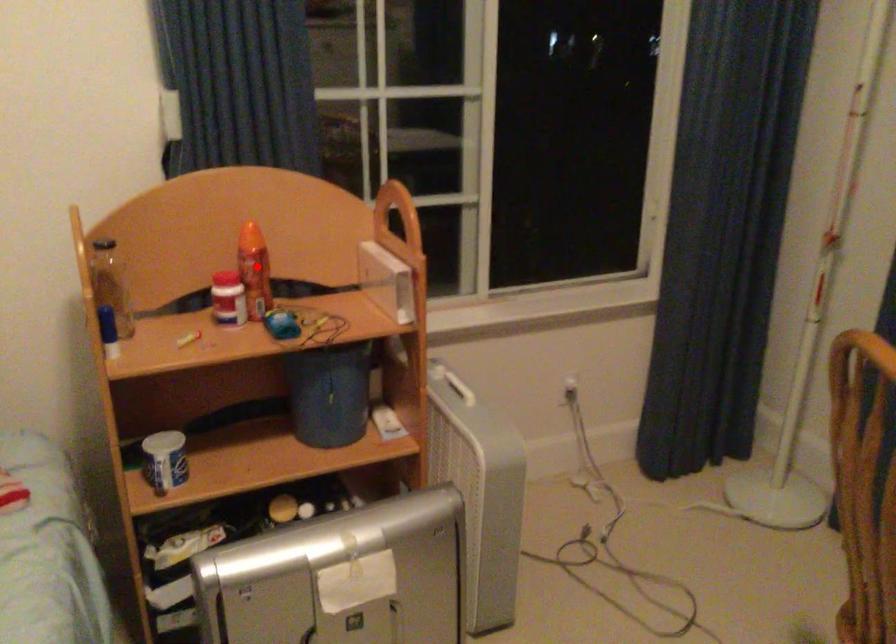
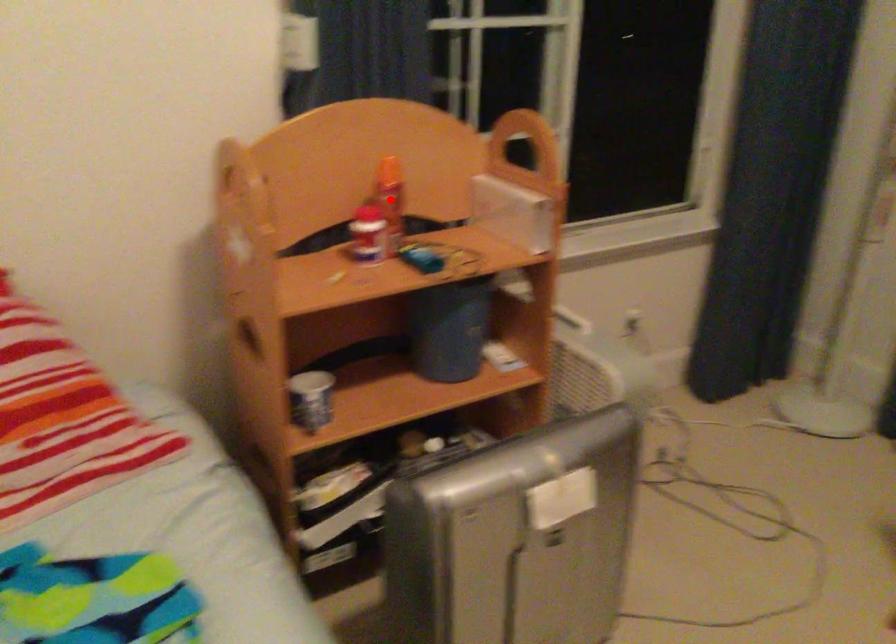
I am providing you with two images of the same scene from different viewpoints. A red point is marked on the first image and another point is marked on the second image. Is the red point in image1 aligned with the point shown in image2?

Yes